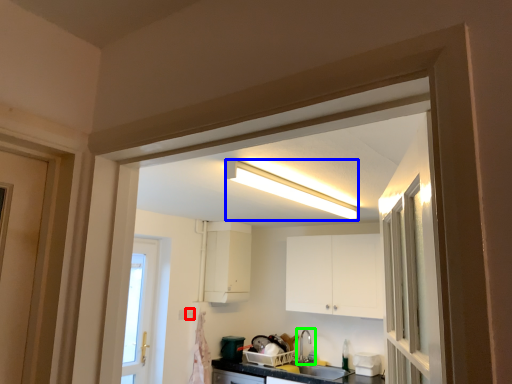
Question: Which object is positioned closest to electric outlet (highlighted by a red box)? Select from light fixture (highlighted by a blue box) and tap (highlighted by a green box).

Choices:
 (A) light fixture
 (B) tap

Answer: (B)